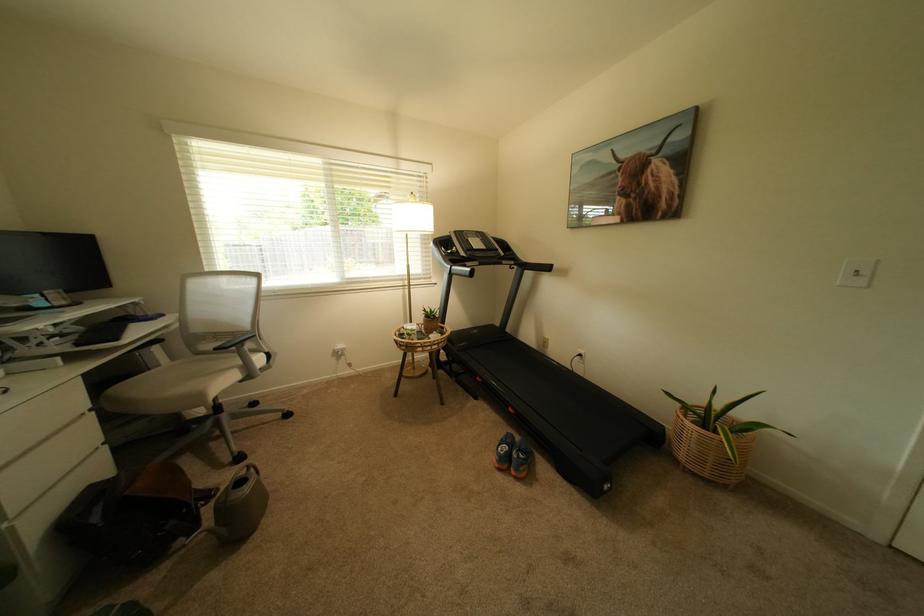
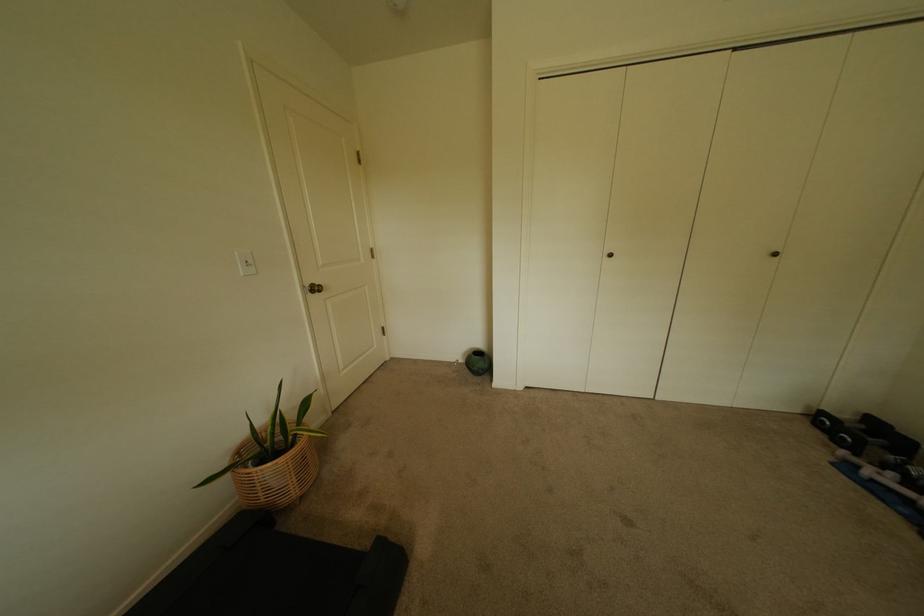
Locate, in the second image, the point that corresponds to point (695, 448) in the first image.

(302, 480)